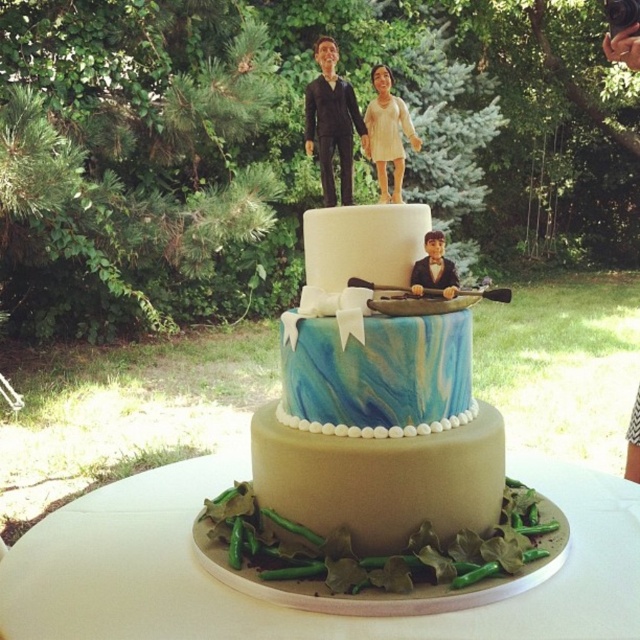
You are a guest at a wedding and want to take a photo with the cake. The photographer suggests standing next to the marble blue cake at center so that it appears larger than the smooth beige figurine at upper center in your photo. Is this possible given their sizes?

The marble blue cake at center is wider than the smooth beige figurine at upper center, so positioning yourself next to the marble blue cake at center will make it appear larger than the smooth beige figurine at upper center in the photo.

You are a guest at the wedding and want to take a photo of the cake. The marble blue cake at center and the matte black suit at center are both in your viewfinder. Which object should you focus on first to ensure it appears larger in the photo?

The marble blue cake at center is in front of the matte black suit at center, so focusing on it first will make it appear larger in the photo.

You are a wedding photographer and need to capture the figurines and the groom in a way that both are clearly visible. Since the smooth matte figurines at upper center and the matte black suit at center are part of the cake design, can you determine which one is placed to the left of the other?

The smooth matte figurines at upper center is positioned on the left side of matte black suit at center, so the smooth matte figurines at upper center is to the left of the matte black suit at center.